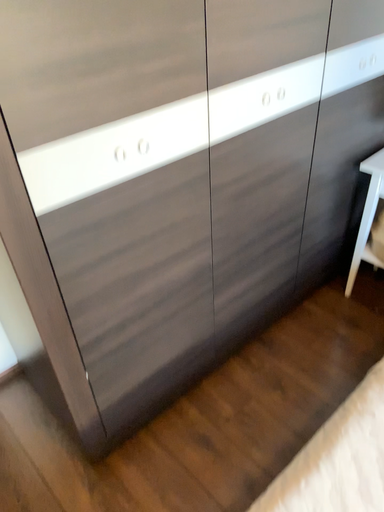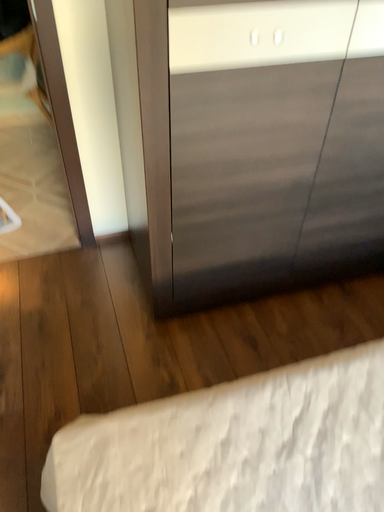
Question: Which way did the camera rotate in the video?

Choices:
 (A) rotated left
 (B) rotated right

Answer: (A)